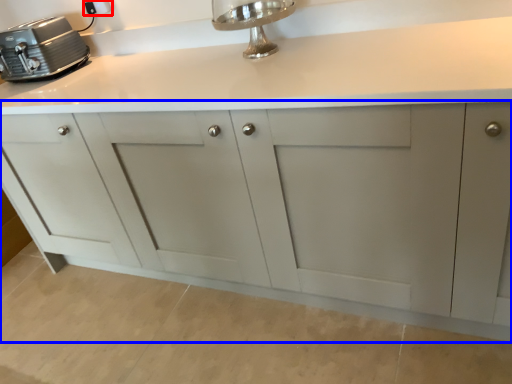
Question: Which object is further to the camera taking this photo, electric outlet (highlighted by a red box) or cabinetry (highlighted by a blue box)?

Choices:
 (A) electric outlet
 (B) cabinetry

Answer: (A)